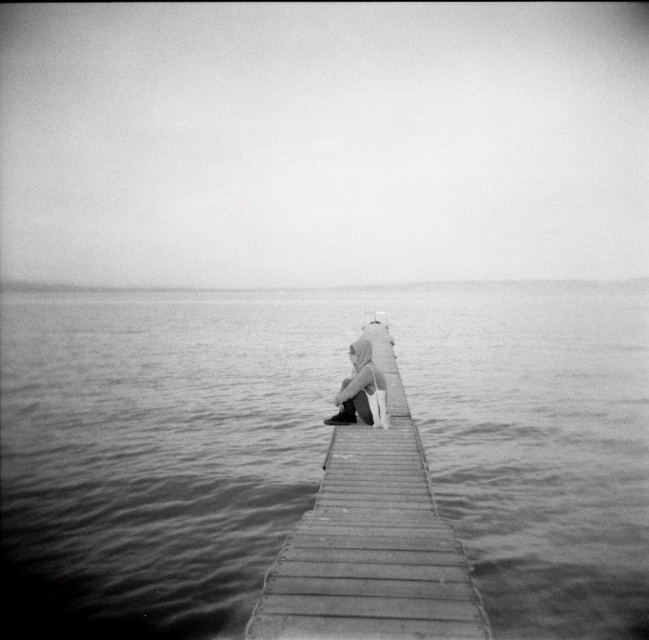
Question: Which object is closer to the camera taking this photo?

Choices:
 (A) smooth water at center
 (B) light gray fabric pants at center

Answer: (A)

Question: Does smooth water at center appear on the right side of light gray fabric pants at center?

Choices:
 (A) no
 (B) yes

Answer: (A)

Question: From the image, what is the correct spatial relationship of smooth water at center in relation to wooden dock at center?

Choices:
 (A) left
 (B) right

Answer: (A)

Question: Which point is farther from the camera taking this photo?

Choices:
 (A) coord(334,419)
 (B) coord(247,481)

Answer: (B)

Question: Among these objects, which one is nearest to the camera?

Choices:
 (A) light gray fabric pants at center
 (B) smooth water at center

Answer: (B)

Question: Does wooden dock at center have a greater width compared to light gray fabric pants at center?

Choices:
 (A) no
 (B) yes

Answer: (B)